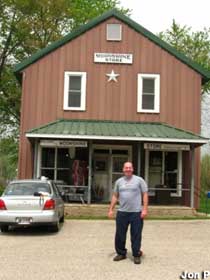
Find the location of `window`. window is located at coordinates (147, 105).